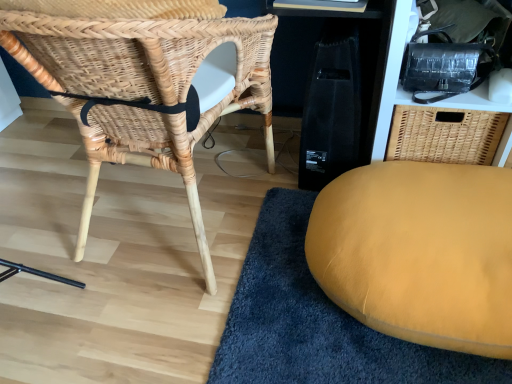
The image size is (512, 384). Find the location of `natural woven chair at left`. natural woven chair at left is located at coordinates (144, 80).

Considering the relative sizes of natural woven chair at left and black textured bag at upper right in the image provided, is natural woven chair at left bigger than black textured bag at upper right?

Correct, natural woven chair at left is larger in size than black textured bag at upper right.

From the image's perspective, would you say natural woven chair at left is shown under black textured bag at upper right?

Yes, from the image's perspective, natural woven chair at left is below black textured bag at upper right.

Looking at this image, is natural woven chair at left far from black textured bag at upper right?

natural woven chair at left is near black textured bag at upper right, not far away.

Is natural woven chair at left positioned with its back to black textured bag at upper right?

No, natural woven chair at left's orientation is not away from black textured bag at upper right.

From a real-world perspective, between natural woven chair at left and mustard yellow cushion at lower right, who is vertically lower?

mustard yellow cushion at lower right, from a real-world perspective.

From the image's perspective, is natural woven chair at left positioned above or below mustard yellow cushion at lower right?

From the image's perspective, natural woven chair at left appears above mustard yellow cushion at lower right.

Is natural woven chair at left turned away from mustard yellow cushion at lower right?

That's not correct — natural woven chair at left is not looking away from mustard yellow cushion at lower right.

Is the depth of natural woven chair at left less than that of mustard yellow cushion at lower right?

That is True.

Does point (475, 275) appear closer or farther from the camera than point (405, 91)?

Point (475, 275).

Which object is positioned more to the right, mustard yellow cushion at lower right or black textured bag at upper right?

black textured bag at upper right.

Locate an element on the screen. The width and height of the screenshot is (512, 384). shelf on the right of the mustard yellow cushion at lower right is located at coordinates (426, 105).

Between mustard yellow cushion at lower right and black textured bag at upper right, which one has less height?

Standing shorter between the two is mustard yellow cushion at lower right.

Is black textured bag at upper right positioned with its back to mustard yellow cushion at lower right?

black textured bag at upper right does not have its back to mustard yellow cushion at lower right.

Identify the location of shelf to the right of mustard yellow cushion at lower right. [426, 105].

Consider the image. Which is closer to the camera, (449, 102) or (348, 298)?

Point (449, 102) is positioned farther from the camera compared to point (348, 298).

From the image's perspective, is mustard yellow cushion at lower right above natural woven chair at left?

Incorrect, from the image's perspective, mustard yellow cushion at lower right is lower than natural woven chair at left.

From a real-world perspective, which object rests below the other?

mustard yellow cushion at lower right is physically lower.

Is mustard yellow cushion at lower right in contact with natural woven chair at left?

There is a gap between mustard yellow cushion at lower right and natural woven chair at left.

Consider the image. Is mustard yellow cushion at lower right shorter than natural woven chair at left?

Indeed, mustard yellow cushion at lower right has a lesser height compared to natural woven chair at left.

Is the surface of black textured bag at upper right in direct contact with natural woven chair at left?

black textured bag at upper right and natural woven chair at left are not in contact.

From the picture: Is black textured bag at upper right closer to camera compared to natural woven chair at left?

No, black textured bag at upper right is behind natural woven chair at left.

Is black textured bag at upper right positioned with its back to natural woven chair at left?

That's not correct — black textured bag at upper right is not looking away from natural woven chair at left.

Who is taller, black textured bag at upper right or natural woven chair at left?

natural woven chair at left.

I want to click on shelf that is behind the natural woven chair at left, so click(426, 105).

The height and width of the screenshot is (384, 512). Identify the location of chair above the mustard yellow cushion at lower right (from the image's perspective). (144, 80).

Based on the photo, based on their spatial positions, is black textured bag at upper right or natural woven chair at left closer to mustard yellow cushion at lower right?

Among the two, black textured bag at upper right is located nearer to mustard yellow cushion at lower right.

When comparing their distances from mustard yellow cushion at lower right, does natural woven chair at left or black textured bag at upper right seem closer?

The object closer to mustard yellow cushion at lower right is black textured bag at upper right.

Based on their spatial positions, is black textured bag at upper right or mustard yellow cushion at lower right closer to natural woven chair at left?

mustard yellow cushion at lower right is closer to natural woven chair at left.

Looking at the image, which one is located further to black textured bag at upper right, mustard yellow cushion at lower right or natural woven chair at left?

Among the two, natural woven chair at left is located further to black textured bag at upper right.

When comparing their distances from natural woven chair at left, does mustard yellow cushion at lower right or black textured bag at upper right seem further?

black textured bag at upper right is positioned further to the anchor natural woven chair at left.

Considering their positions, is natural woven chair at left positioned further to black textured bag at upper right than mustard yellow cushion at lower right?

Among the two, natural woven chair at left is located further to black textured bag at upper right.

At what (x,y) coordinates should I click in order to perform the action: click on furniture located between natural woven chair at left and black textured bag at upper right in the left-right direction. Please return your answer as a coordinate pair (x, y). The height and width of the screenshot is (384, 512). Looking at the image, I should click on (419, 252).